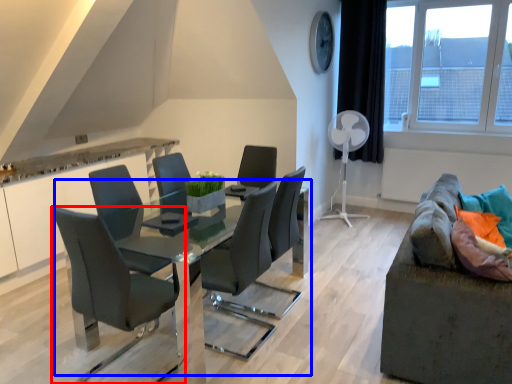
Question: Which of the following is the farthest to the observer, chair (highlighted by a red box) or table (highlighted by a blue box)?

Choices:
 (A) chair
 (B) table

Answer: (B)